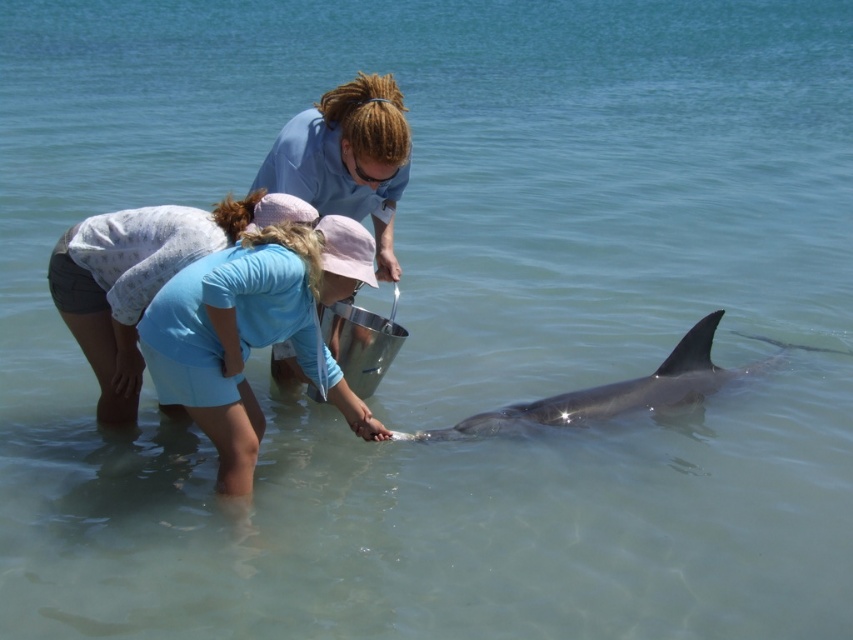
Can you confirm if blue cotton shirt at center is positioned to the left of gray smooth dolphin at lower center?

Yes, blue cotton shirt at center is to the left of gray smooth dolphin at lower center.

Who is lower down, blue cotton shirt at center or gray smooth dolphin at lower center?

gray smooth dolphin at lower center is below.

Which is in front, point (254, 410) or point (747, 337)?

Point (254, 410) is in front.

Where is `blue cotton shirt at center`? The width and height of the screenshot is (853, 640). blue cotton shirt at center is located at coordinates (254, 332).